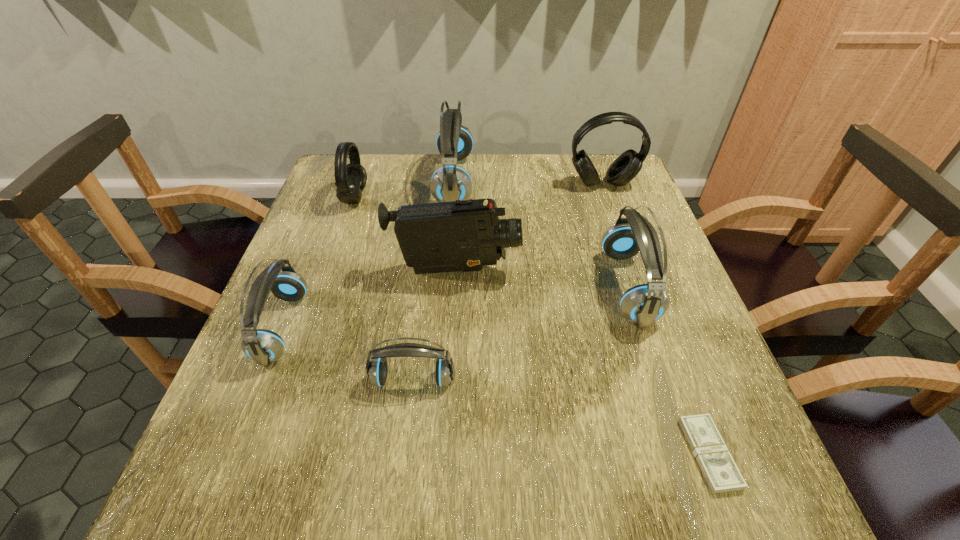
This screenshot has width=960, height=540. I want to click on free spot located on the ear cups of the farthest blue headset, so click(x=505, y=181).

You are a GUI agent. You are given a task and a screenshot of the screen. Output one action in this format:
    pyautogui.click(x=<x>, y=<y>)
    Task: Click on the free space located 0.310m on the earcups of the right gray headset
    The width and height of the screenshot is (960, 540).
    Given the screenshot: What is the action you would take?
    [x=633, y=270]

Identify the location of free region located on the front-facing side of the camcorder. The width and height of the screenshot is (960, 540). (564, 271).

Locate an element on the screen. The width and height of the screenshot is (960, 540). free space located on the ear cups of the third smallest blue headset is located at coordinates (506, 287).

Locate an element on the screen. The height and width of the screenshot is (540, 960). vacant space located 0.400m on the ear cups of the third smallest blue headset is located at coordinates (423, 287).

The height and width of the screenshot is (540, 960). I want to click on vacant space located 0.160m on the ear cups of the third smallest blue headset, so click(x=533, y=287).

Locate an element on the screen. The height and width of the screenshot is (540, 960). vacant space located 0.180m on the earcups of the smaller gray headset is located at coordinates (432, 198).

Locate an element on the screen. This screenshot has width=960, height=540. free region located 0.260m on the ear cups of the third biggest blue headset is located at coordinates (431, 327).

Locate an element on the screen. free space located on the ear cups of the smallest blue headset is located at coordinates (403, 454).

Find the location of a particular element. Image resolution: width=960 pixels, height=540 pixels. vacant point located 0.060m on the back of the money is located at coordinates (684, 387).